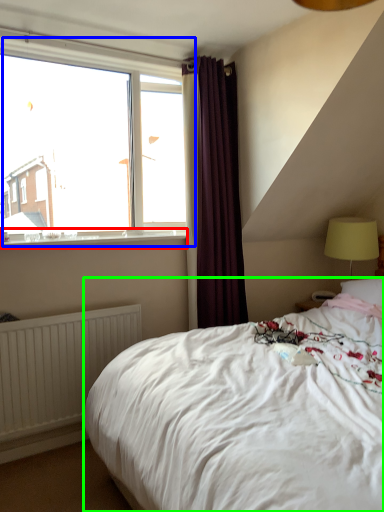
Question: Estimate the real-world distances between objects in this image. Which object is farther from window sill (highlighted by a red box), window (highlighted by a blue box) or bed (highlighted by a green box)?

Choices:
 (A) window
 (B) bed

Answer: (B)